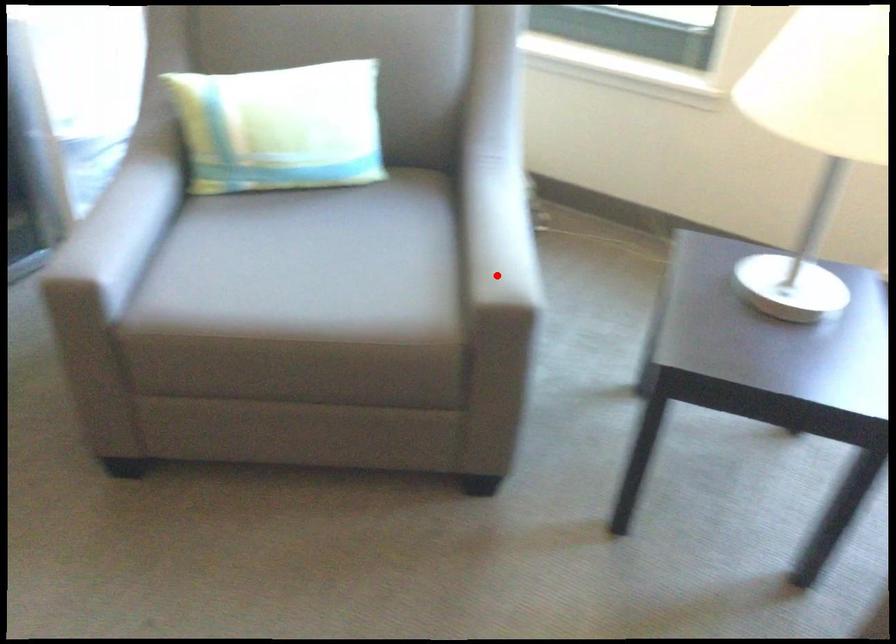
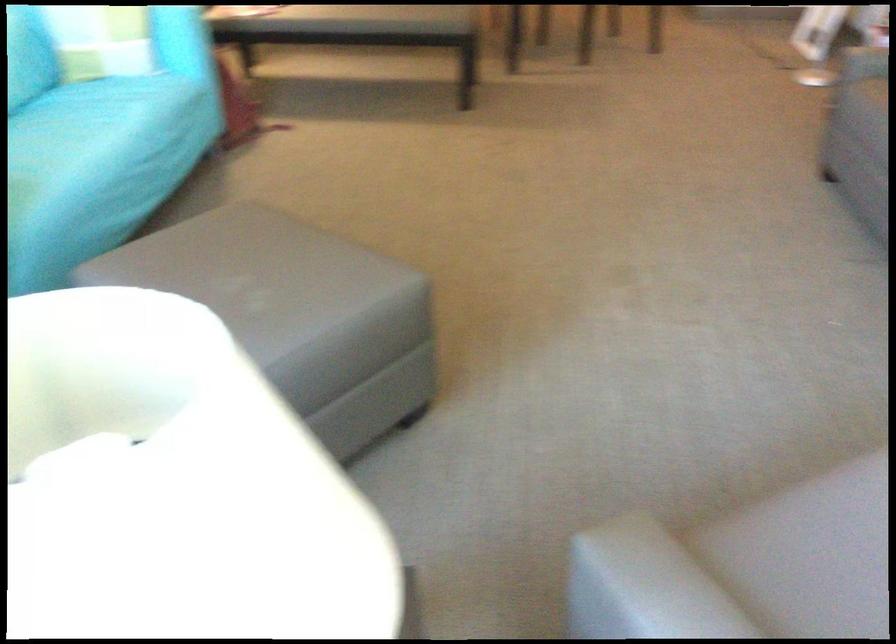
Where in the second image is the point corresponding to the highlighted location from the first image?

(665, 583)